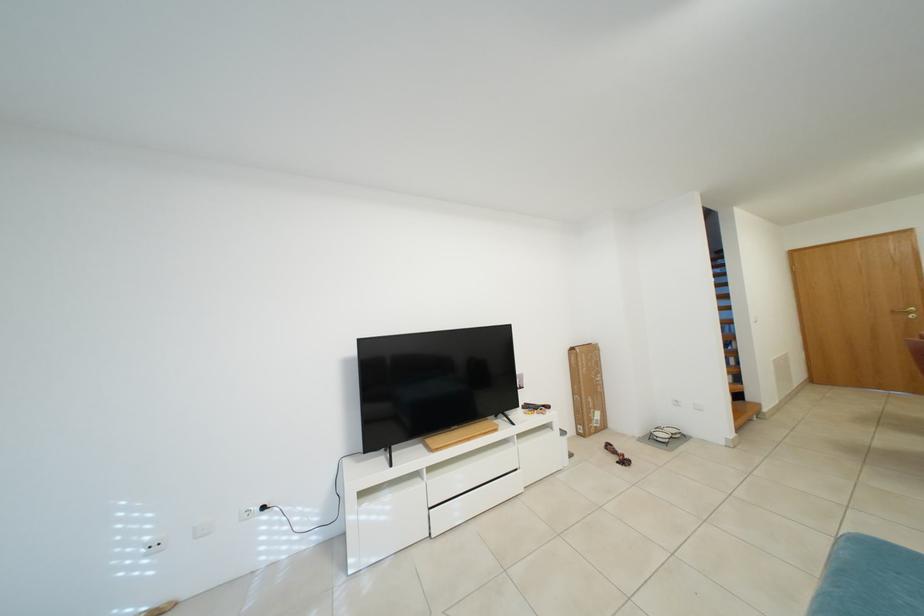
The image size is (924, 616). What are the coordinates of `white pet bowl` in the screenshot? It's located at (660, 435).